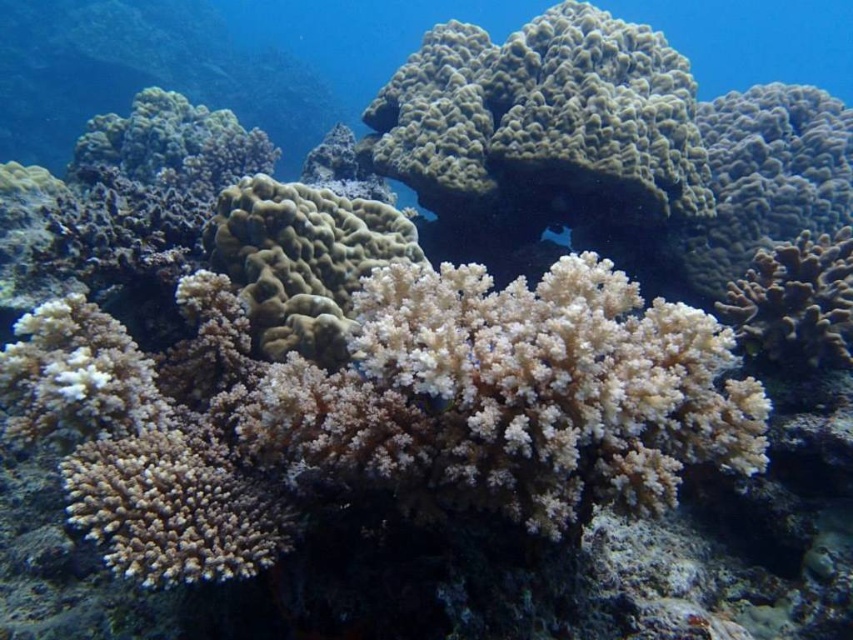
You are a diver with a camera and you want to take a photo of the coral formations. The camera can focus on objects within a 1.5 meters range. Is the point at coordinate point (282, 317) within the camera focus range?

The point at coordinate point (282, 317) is 1.72 meters away from the camera, which is beyond the camera focus range of 1.5 meters. Therefore, the camera cannot focus on that point.